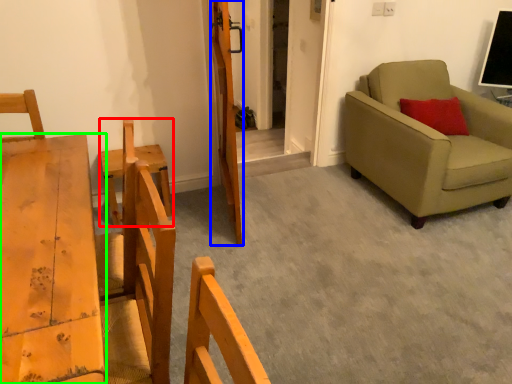
Question: Estimate the real-world distances between objects in this image. Which object is farther from armchair (highlighted by a red box), door (highlighted by a blue box) or furniture (highlighted by a green box)?

Choices:
 (A) door
 (B) furniture

Answer: (A)